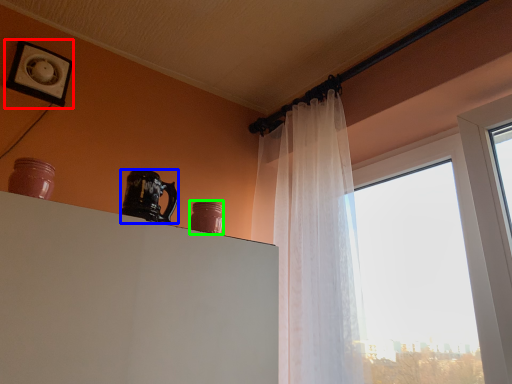
Question: Which object is positioned farthest from picture frame (highlighted by a red box)? Select from coffee cup (highlighted by a blue box) and pottery (highlighted by a green box).

Choices:
 (A) coffee cup
 (B) pottery

Answer: (B)